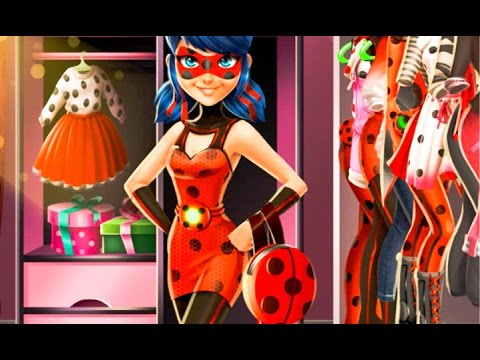
The width and height of the screenshot is (480, 360). I want to click on clothes rack, so click(101, 54).